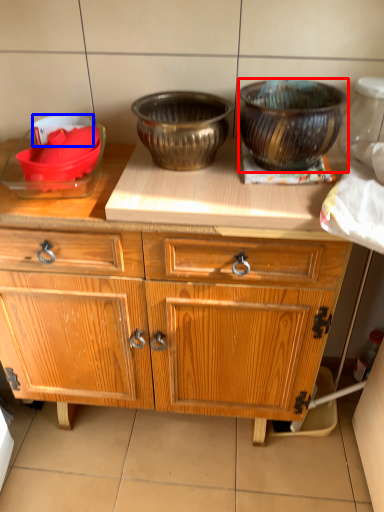
Question: Among these objects, which one is nearest to the camera, bowl (highlighted by a red box) or bowl (highlighted by a blue box)?

Choices:
 (A) bowl
 (B) bowl

Answer: (A)